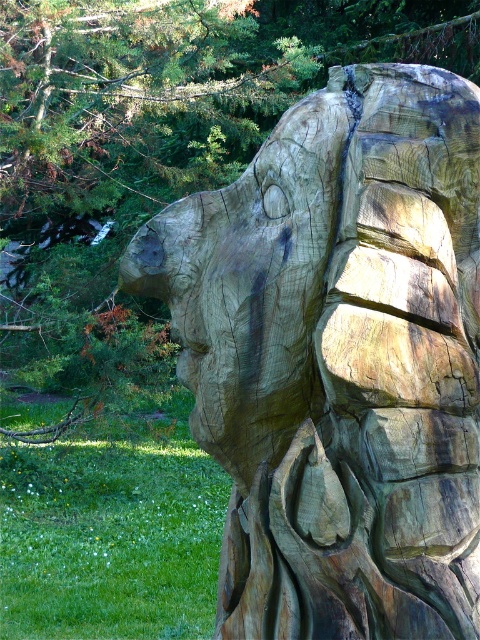
You are an art conservator examining the natural wood carving at center and the wooden carving at center in the sculpture. Which one has a greater height?

The wooden carving at center is taller than the natural wood carving at center, so the wooden carving at center has a greater height.

You are an art installer who needs to place a 2.5 meter long beam between the natural wood carving at center and the wooden carving at center. Is there enough space between them to fit the beam?

The natural wood carving at center and wooden carving at center are 2.48 meters apart from each other. Since the beam is 2.5 meters long, it is slightly longer than the available space. Therefore, the beam cannot fit between them.